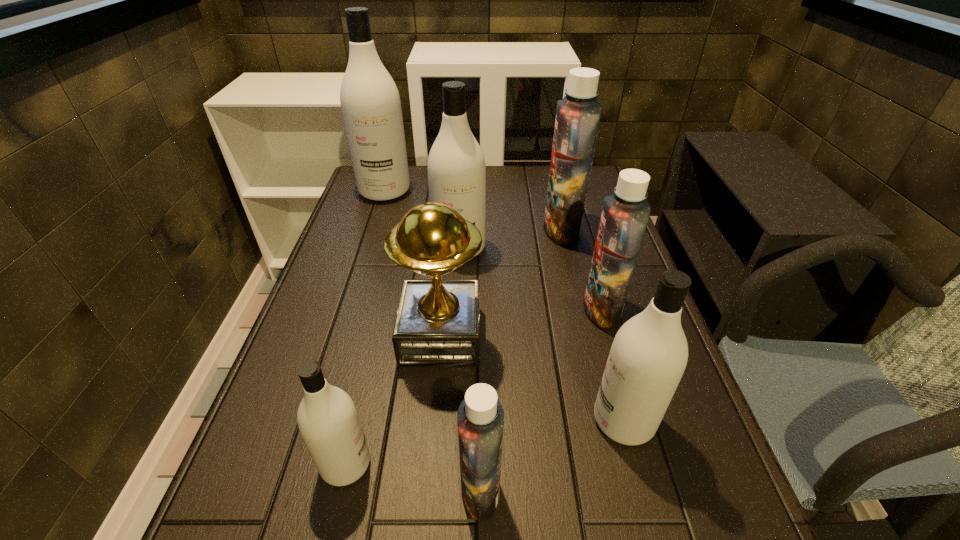
This screenshot has width=960, height=540. Find the location of `free space located 0.210m on the front-facing side of the second smallest white shampoo`. free space located 0.210m on the front-facing side of the second smallest white shampoo is located at coordinates (483, 421).

The image size is (960, 540). Find the location of `free space located on the front-facing side of the second smallest white shampoo`. free space located on the front-facing side of the second smallest white shampoo is located at coordinates (462, 421).

Find the location of `free space located 0.240m on the front-facing side of the second smallest white shampoo`. free space located 0.240m on the front-facing side of the second smallest white shampoo is located at coordinates (468, 421).

Identify the location of vacant area situated on the front-facing side of the gold award. (557, 335).

Locate an element on the screen. blank space located on the front label of the smallest blue shampoo is located at coordinates (284, 490).

Where is `free region located on the front label of the smallest blue shampoo`? free region located on the front label of the smallest blue shampoo is located at coordinates click(x=414, y=490).

What are the coordinates of `vacant space located 0.300m on the front label of the smallest blue shampoo` in the screenshot? It's located at (284, 490).

The height and width of the screenshot is (540, 960). Identify the location of free space located on the front-facing side of the smallest white shampoo. (478, 464).

Identify the location of object at the far edge. (370, 102).

Where is `object located at the far left corner`? object located at the far left corner is located at coordinates (370, 102).